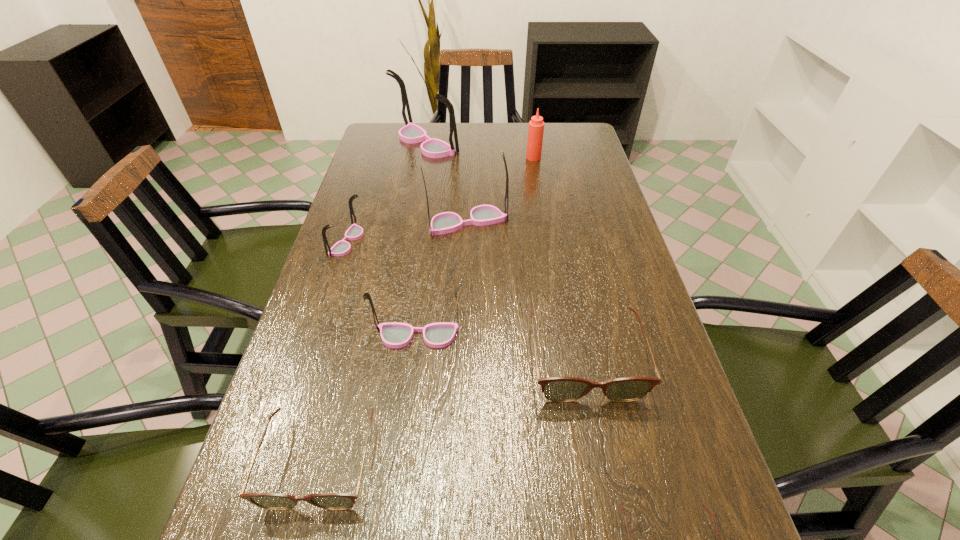
Identify the location of the leftmost brown spectacles. This screenshot has width=960, height=540. (274, 501).

Locate an element on the screen. The width and height of the screenshot is (960, 540). the sixth farthest spectacles is located at coordinates (274, 501).

Identify the location of vacant space located 0.400m on the front of the farthest pink spectacles. This screenshot has width=960, height=540. pos(409,238).

Locate an element on the screen. The image size is (960, 540). free point located on the back of the second tallest spectacles is located at coordinates (469, 172).

Where is `free region located 0.390m on the left of the Tabasco sauce`? The height and width of the screenshot is (540, 960). free region located 0.390m on the left of the Tabasco sauce is located at coordinates (412, 158).

Locate an element on the screen. This screenshot has height=540, width=960. vacant area situated on the left of the third tallest spectacles is located at coordinates (349, 335).

You are a GUI agent. You are given a task and a screenshot of the screen. Output one action in this format:
    pyautogui.click(x=<x>, y=<y>)
    Task: Click on the vacant space situated on the front of the fourth tallest spectacles
    This screenshot has width=960, height=540.
    Given the screenshot: What is the action you would take?
    pyautogui.click(x=302, y=377)

The height and width of the screenshot is (540, 960). Find the location of `free location located at the front view of the fifth tallest spectacles`. free location located at the front view of the fifth tallest spectacles is located at coordinates (597, 427).

Find the location of a particular element. This screenshot has width=960, height=540. spectacles located in the far edge section of the desktop is located at coordinates (411, 133).

At what (x,y) coordinates should I click in order to perform the action: click on Tabasco sauce located in the far edge section of the desktop. Please return your answer as a coordinate pair (x, y). Looking at the image, I should click on (536, 126).